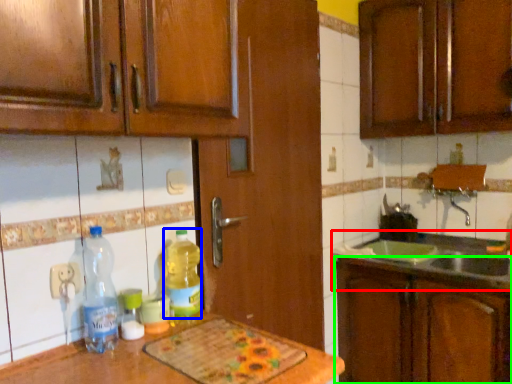
Question: Based on their relative distances, which object is nearer to sink (highlighted by a red box)? Choose from bottle (highlighted by a blue box) and cabinetry (highlighted by a green box).

Choices:
 (A) bottle
 (B) cabinetry

Answer: (B)